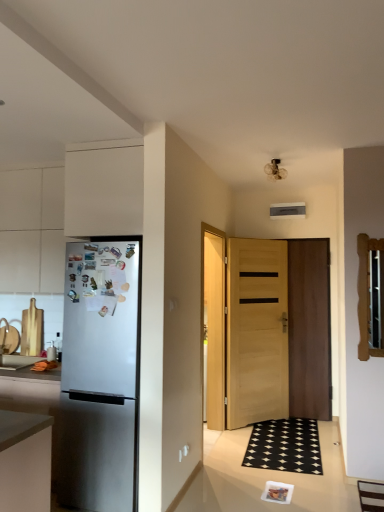
Question: Does wooden door at center, positioned as the first door in right-to-left order, appear on the right side of matte gray countertop at left?

Choices:
 (A) yes
 (B) no

Answer: (A)

Question: Can you confirm if wooden door at center, the 2th door when ordered from left to right, is positioned to the left of matte gray countertop at left?

Choices:
 (A) no
 (B) yes

Answer: (A)

Question: Are wooden door at center, the 2th door when ordered from left to right, and matte gray countertop at left making contact?

Choices:
 (A) yes
 (B) no

Answer: (B)

Question: From the image's perspective, is wooden door at center, the 2th door when ordered from left to right, below matte gray countertop at left?

Choices:
 (A) yes
 (B) no

Answer: (B)

Question: Can we say wooden door at center, positioned as the first door in right-to-left order, lies outside matte gray countertop at left?

Choices:
 (A) no
 (B) yes

Answer: (B)

Question: In the image, is wooden door at center, positioned as the first door in right-to-left order, positioned in front of or behind matte gray countertop at left?

Choices:
 (A) front
 (B) behind

Answer: (B)

Question: Considering the positions of point (309, 309) and point (46, 373), is point (309, 309) closer or farther from the camera than point (46, 373)?

Choices:
 (A) closer
 (B) farther

Answer: (B)

Question: From the image's perspective, is wooden door at center, positioned as the first door in right-to-left order, positioned above or below matte gray countertop at left?

Choices:
 (A) above
 (B) below

Answer: (A)

Question: Based on their positions, is wooden door at center, positioned as the first door in right-to-left order, located to the left or right of matte gray countertop at left?

Choices:
 (A) right
 (B) left

Answer: (A)

Question: Is light brown wooden door at center, positioned as the 2th door in right-to-left order, in front of or behind matte gray countertop at left in the image?

Choices:
 (A) behind
 (B) front

Answer: (A)

Question: Is point (274, 291) closer or farther from the camera than point (39, 358)?

Choices:
 (A) closer
 (B) farther

Answer: (B)

Question: From the image's perspective, is light brown wooden door at center, positioned as the 2th door in right-to-left order, positioned above or below matte gray countertop at left?

Choices:
 (A) below
 (B) above

Answer: (B)

Question: Is light brown wooden door at center, positioned as the 2th door in right-to-left order, situated inside matte gray countertop at left or outside?

Choices:
 (A) inside
 (B) outside

Answer: (B)

Question: Is matte gray countertop at left inside the boundaries of light brown wooden door at center, which is the first door in left-to-right order, or outside?

Choices:
 (A) outside
 (B) inside

Answer: (A)

Question: Is point (26, 373) positioned closer to the camera than point (264, 400)?

Choices:
 (A) closer
 (B) farther

Answer: (A)